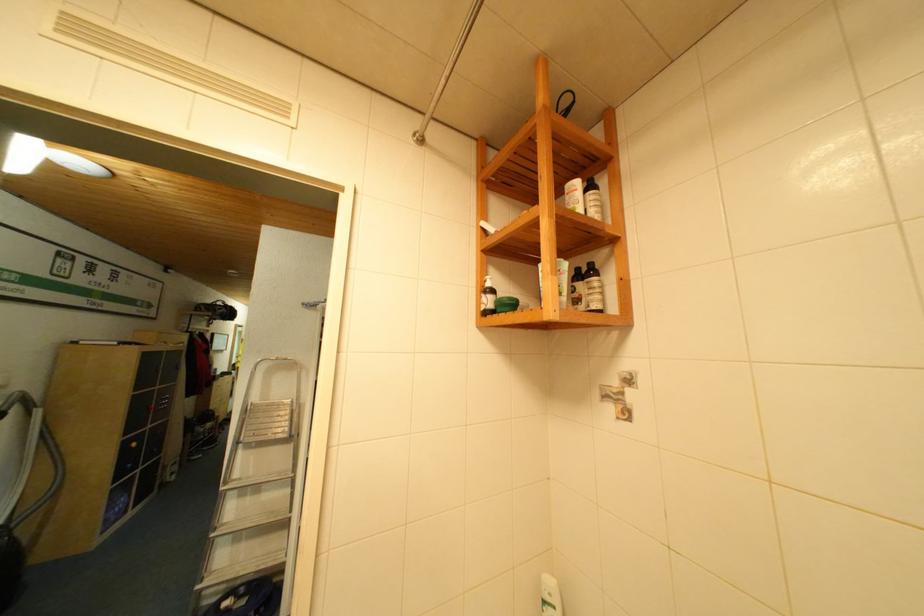
Find where to plac the metal step ladder. Please return your answer as a coordinate pair (x, y).

(257, 490)